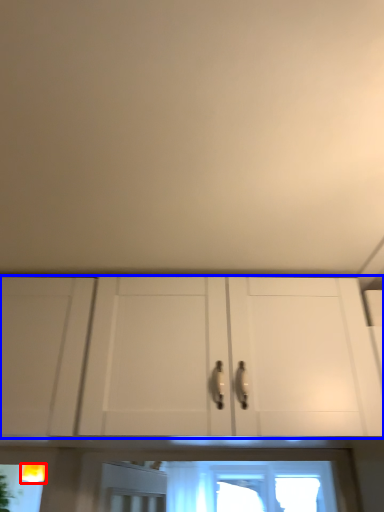
Question: Which of the following is the closest to the observer, light fixture (highlighted by a red box) or cabinetry (highlighted by a blue box)?

Choices:
 (A) light fixture
 (B) cabinetry

Answer: (B)